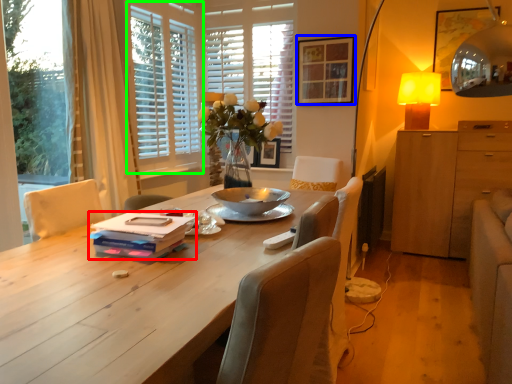
Question: Which object is the closest to the book (highlighted by a red box)? Choose among these: picture frame (highlighted by a blue box) or window frame (highlighted by a green box).

Choices:
 (A) picture frame
 (B) window frame

Answer: (B)